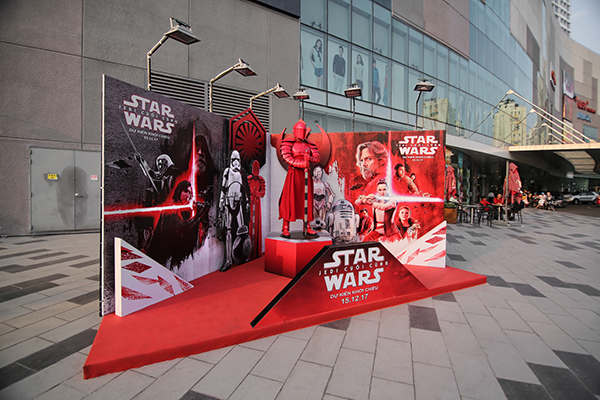
I want to click on display, so click(312, 224).